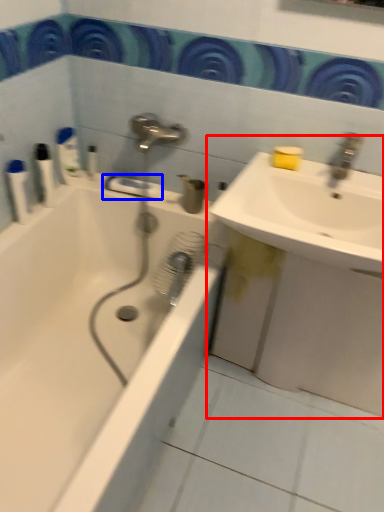
Question: Which object appears closest to the camera in this image, sink (highlighted by a red box) or towel bar (highlighted by a blue box)?

Choices:
 (A) sink
 (B) towel bar

Answer: (A)